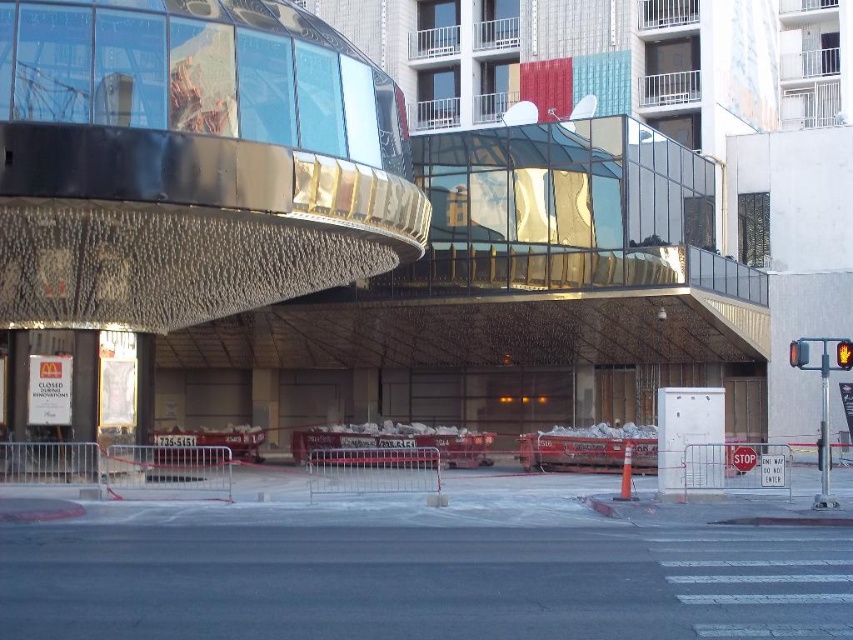
You are a city planner analyzing the urban layout. You need to determine if the red glass traffic light at right and the yellow matte pedestrian signal at upper right can both fit within a 1.5 meter wide inspection zone. Can they?

The red glass traffic light at right might be wider than yellow matte pedestrian signal at upper right, so it is uncertain if both can fit within the 1.5 meter wide inspection zone without overlapping or exceeding the space.

You are a delivery drone operator. Your drone is currently at the center of the image. You need to fly to the red glass traffic light at right. What direction should you fly to reach it?

The red glass traffic light at right is located at point 0.552 on the x axis and 0.937 on the y axis. Since the drone is at the center, it should fly towards the right and slightly upwards to reach the traffic light.

You are a delivery person with a cart that is 2 meters wide. You need to move from the red glass traffic light at right to the yellow matte pedestrian signal at upper right. Can your cart fit through the space between them?

The distance between the red glass traffic light at right and the yellow matte pedestrian signal at upper right is 6.65 meters. Since your cart is only 2 meters wide, there is sufficient space for it to pass through the gap between them.